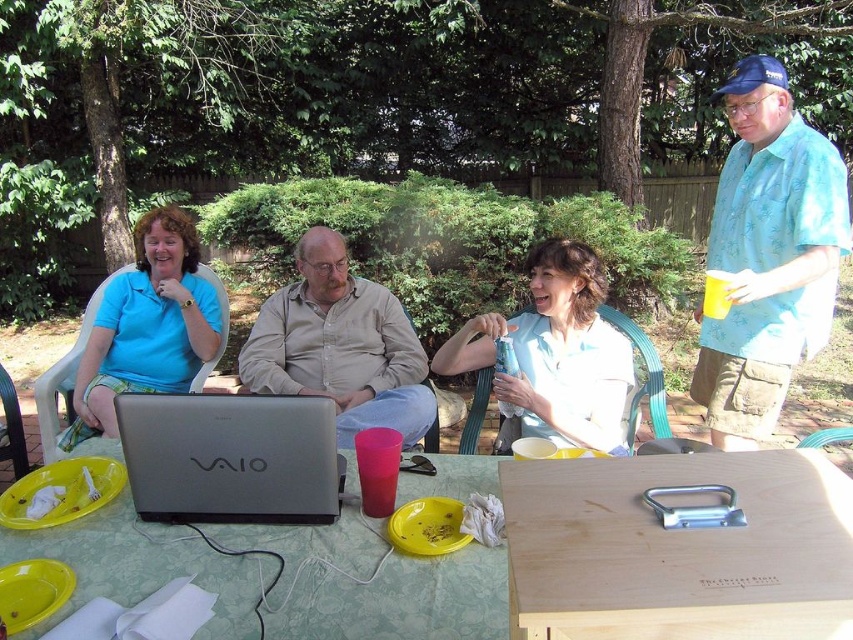
You are a small robot with a width of 16 inches. You need to move from the wooden at center to the green fabric table at lower left. Is there enough space for you to pass through the area between them?

The distance between the wooden at center and the green fabric table at lower left is 18.37 inches, which is wider than your 16 inches width, so you can pass through the space between them.

You are organizing a group photo and need to arrange two people based on their shirt sizes. If you have the light beige shirt at center and the matte blue shirt at center, which shirt should be placed in the front row to ensure visibility?

The light beige shirt at center should be placed in the front row because it has a larger size compared to the matte blue shirt at center, making it more visible.